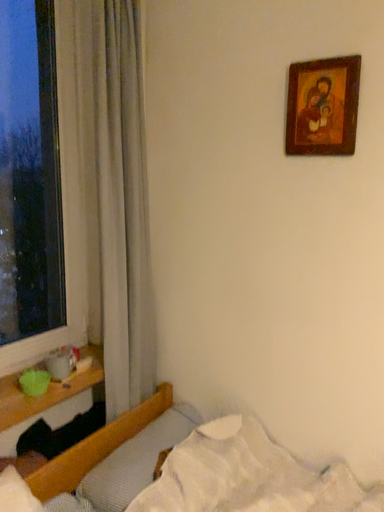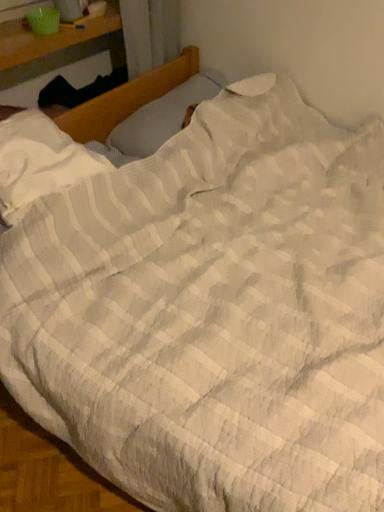
Question: Which way did the camera rotate in the video?

Choices:
 (A) rotated downward
 (B) rotated upward

Answer: (A)